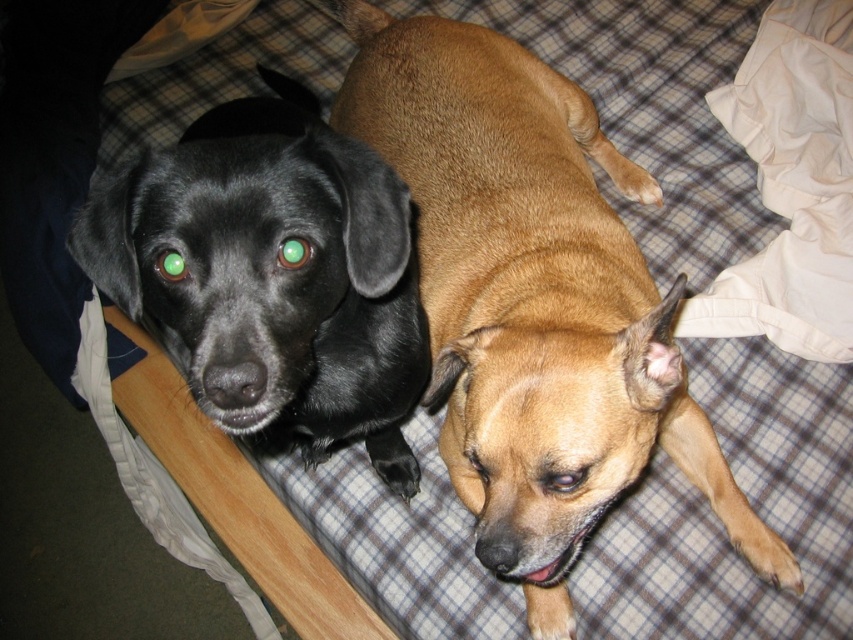
Please provide the exact coordinates of the brown matte dog at center in the image. The coordinate system is normalized, meaning the top left corner is at point 0.0, 0.0 and the bottom right corner is at point 1.0, 1.0. The coordinates are represented as a pair of numbers between 0.0 and 1.0, separated by a comma. Please answer with the coordinates in the format of x,y. The answer should be the exact value provided in the Objects Description.

The exact coordinates of the brown matte dog at center are [532,300].

You are a dog owner who wants to ensure both dogs have enough space on the plaid bedspread. Given that the bedspread is 1.5 meters wide, can both the shiny black dog at left and the brown matte dog at center fit side by side without overlapping?

The brown matte dog at center is wider than the shiny black dog at left. Since the bedspread is 1.5 meters wide, but we don not have exact measurements for either dog, it is uncertain if they can fit side by side without overlapping.